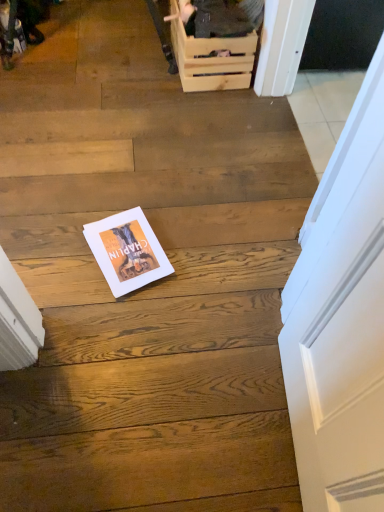
Question: In terms of height, does wooden crate at upper center look taller or shorter compared to wooden crate at upper center?

Choices:
 (A) short
 (B) tall

Answer: (B)

Question: Which is correct: wooden crate at upper center is inside wooden crate at upper center, or outside of it?

Choices:
 (A) inside
 (B) outside

Answer: (B)

Question: Estimate the real-world distances between objects in this image. Which object is farther from the wooden crate at upper center?

Choices:
 (A) white paper magazine at center
 (B) wooden crate at upper center

Answer: (A)

Question: Estimate the real-world distances between objects in this image. Which object is farther from the white paper magazine at center?

Choices:
 (A) wooden crate at upper center
 (B) wooden crate at upper center

Answer: (B)